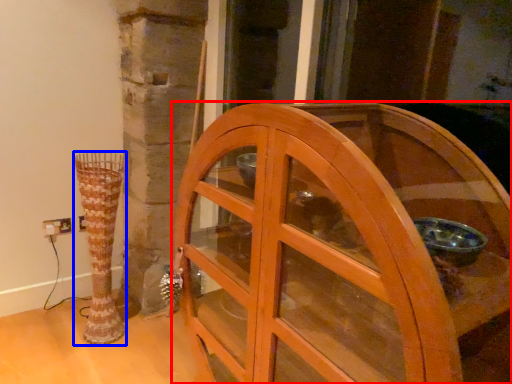
Question: Which object appears farthest to the camera in this image, furniture (highlighted by a red box) or vase (highlighted by a blue box)?

Choices:
 (A) furniture
 (B) vase

Answer: (B)